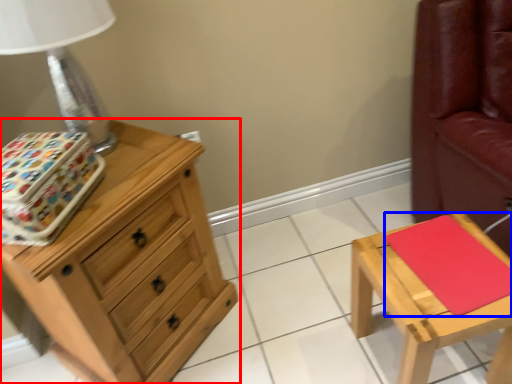
Question: Which point is closer to the camera, chest of drawers (highlighted by a red box) or pad (highlighted by a blue box)?

Choices:
 (A) chest of drawers
 (B) pad

Answer: (A)